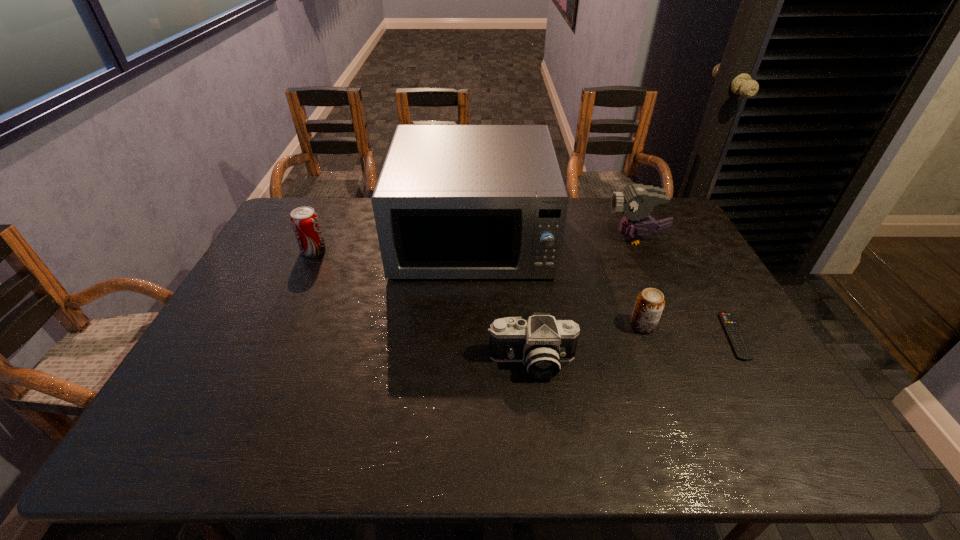
Where is `vacant space that satisfies the following two spatial constraints: 1. on the front side of the fifth tallest object; 2. on the left side of the remote control`? vacant space that satisfies the following two spatial constraints: 1. on the front side of the fifth tallest object; 2. on the left side of the remote control is located at coordinates (647, 336).